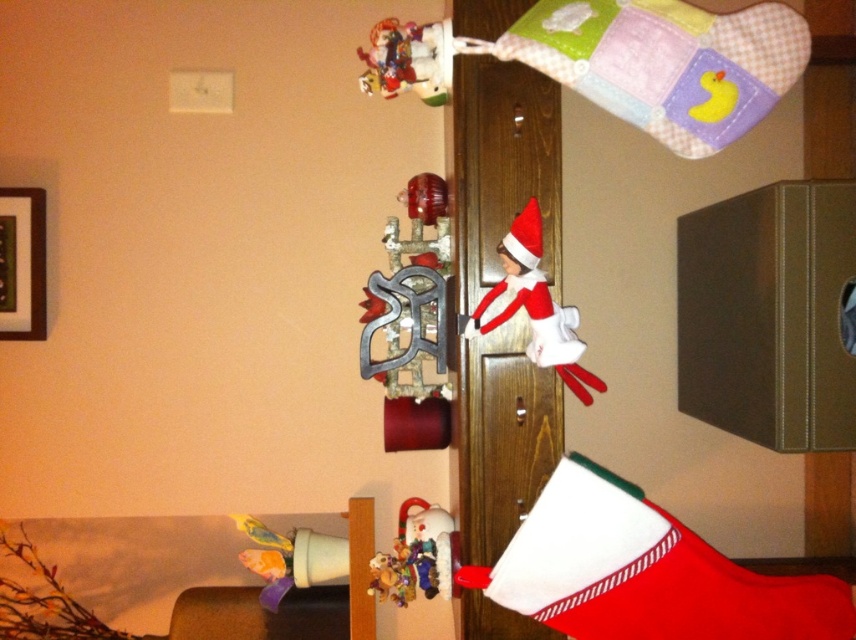
Question: Does metallic silver ornament at upper center appear over white fabric elf at center?

Choices:
 (A) yes
 (B) no

Answer: (A)

Question: Is white fabric elf at center wider than matte plastic toy at lower left?

Choices:
 (A) yes
 (B) no

Answer: (B)

Question: Which object is closer to the camera taking this photo?

Choices:
 (A) matte plastic toy at lower left
 (B) velvety plush teddy bear at center
 (C) metallic silver ornament at upper center

Answer: (C)

Question: Is white fabric elf at center in front of matte plastic elf at upper center?

Choices:
 (A) yes
 (B) no

Answer: (A)

Question: Which object is positioned closest to the velvety plush teddy bear at center?

Choices:
 (A) matte plastic elf at upper center
 (B) matte plastic toy at lower left
 (C) metallic silver ornament at upper center

Answer: (B)

Question: Which point is farther to the camera?

Choices:
 (A) (450, 579)
 (B) (270, 600)
 (C) (421, 422)

Answer: (B)